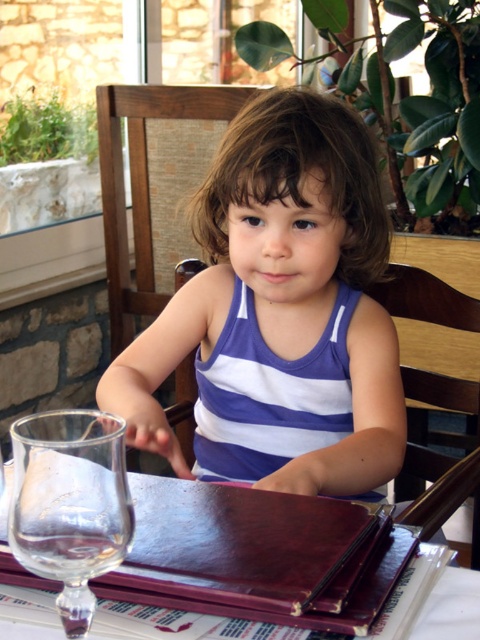
Question: Estimate the real-world distances between objects in this image. Which object is closer to the transparent glass at lower left?

Choices:
 (A) brown leather menu at center
 (B) purple striped tank top at center

Answer: (A)

Question: Based on their relative distances, which object is nearer to the transparent glass at lower left?

Choices:
 (A) brown leather menu at center
 (B) purple striped tank top at center

Answer: (A)

Question: Among these points, which one is nearest to the camera?

Choices:
 (A) (13, 628)
 (B) (70, 589)
 (C) (330, 493)

Answer: (B)

Question: In this image, where is purple striped tank top at center located relative to brown leather menu at center?

Choices:
 (A) below
 (B) above

Answer: (B)

Question: Does purple striped tank top at center have a lesser width compared to transparent glass at lower left?

Choices:
 (A) yes
 (B) no

Answer: (B)

Question: Is transparent glass at lower left wider than brown leather menu at center?

Choices:
 (A) no
 (B) yes

Answer: (A)